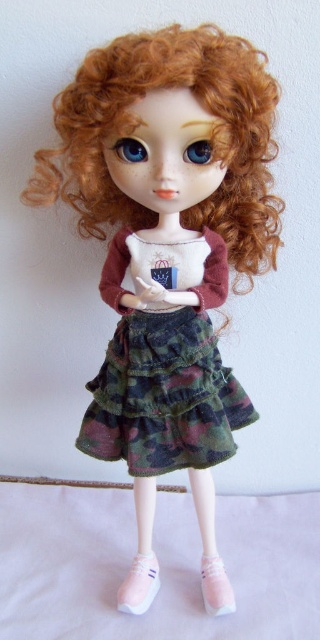
Question: Which of these objects is positioned farthest from the camouflage fabric skirt at center?

Choices:
 (A) pink fabric shoe at lower center
 (B) pink suede shoe at lower center

Answer: (B)

Question: Can you confirm if camouflage fabric skirt at center is bigger than pink suede shoe at lower center?

Choices:
 (A) no
 (B) yes

Answer: (B)

Question: Can you confirm if camouflage fabric skirt at center is bigger than pink fabric shoe at lower center?

Choices:
 (A) no
 (B) yes

Answer: (B)

Question: Among these objects, which one is nearest to the camera?

Choices:
 (A) pink suede shoe at lower center
 (B) pink fabric shoe at lower center
 (C) camouflage fabric skirt at center

Answer: (C)

Question: Which of the following is the farthest from the observer?

Choices:
 (A) (160, 400)
 (B) (129, 568)

Answer: (B)

Question: Is pink fabric shoe at lower center positioned behind pink suede shoe at lower center?

Choices:
 (A) yes
 (B) no

Answer: (A)